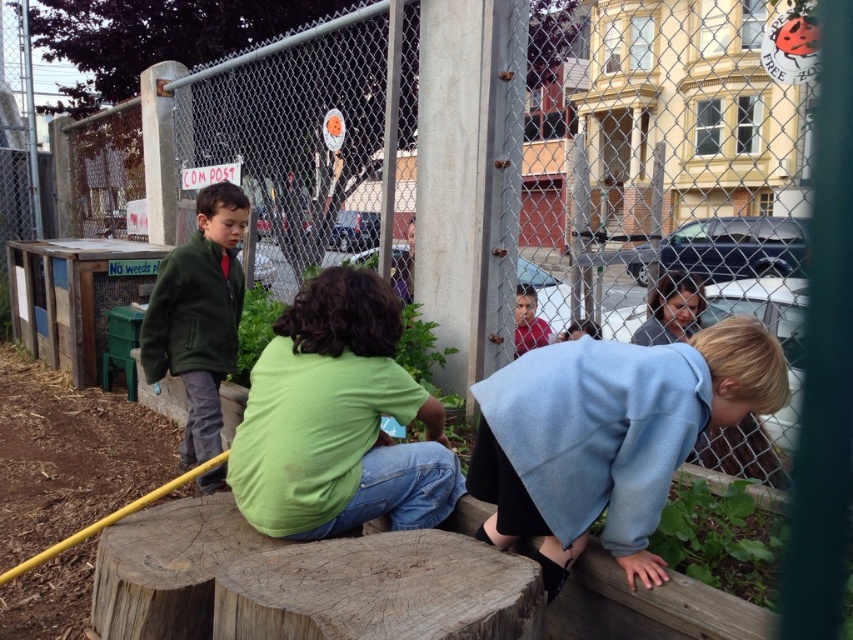
Question: Which point is closer to the camera taking this photo?

Choices:
 (A) (238, 497)
 (B) (163, 273)
 (C) (532, 532)
 (D) (532, 288)

Answer: (C)

Question: Can you confirm if green fleece sweatshirt at left is bigger than matte green shirt at center?

Choices:
 (A) no
 (B) yes

Answer: (A)

Question: Which of the following is the farthest from the observer?

Choices:
 (A) (202, 204)
 (B) (183, 275)
 (C) (683, 378)
 (D) (265, 456)

Answer: (A)

Question: Which point is closer to the camera?

Choices:
 (A) green fleece sweatshirt at left
 (B) matte green shirt at center
 (C) light blue fleece jacket at lower right

Answer: (C)

Question: Does green fuzzy jacket at left have a smaller size compared to matte green shirt at center?

Choices:
 (A) yes
 (B) no

Answer: (A)

Question: Is light blue fleece jacket at lower right closer to the viewer compared to matte green shirt at center?

Choices:
 (A) no
 (B) yes

Answer: (B)